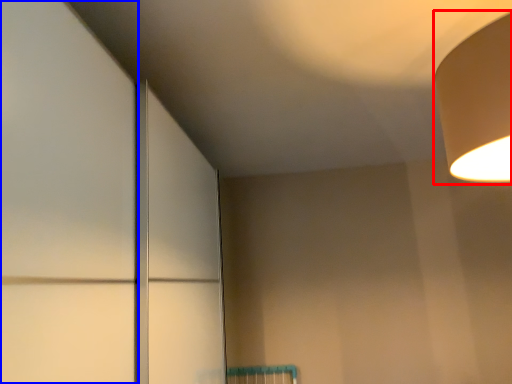
Question: Which object is further to the camera taking this photo, lamp (highlighted by a red box) or door (highlighted by a blue box)?

Choices:
 (A) lamp
 (B) door

Answer: (A)